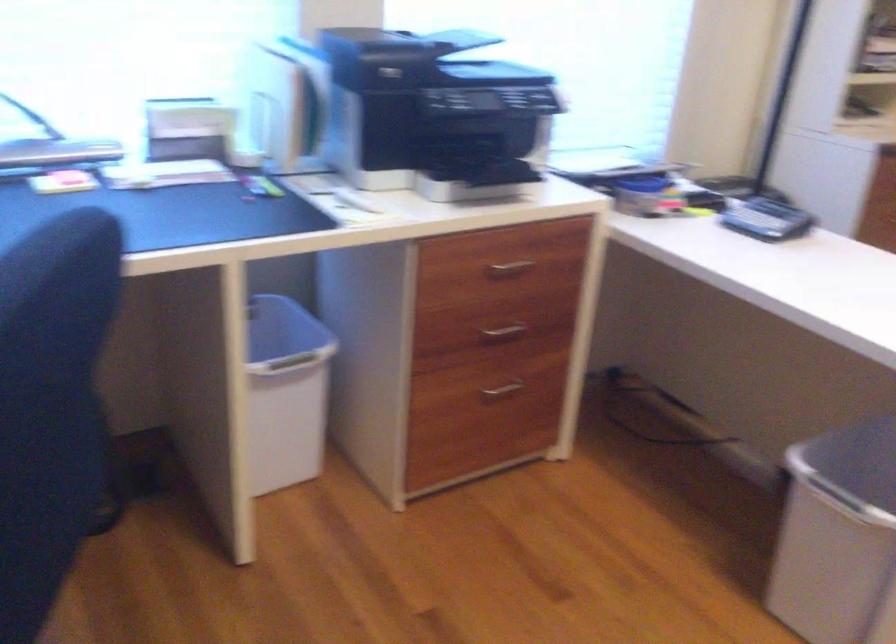
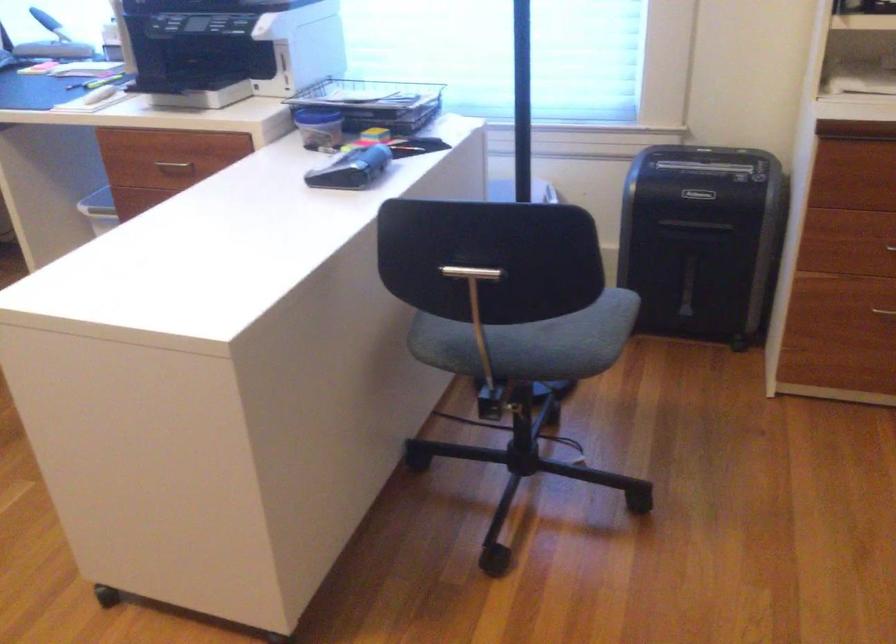
Question: I am providing you with two images of the same scene from different viewpoints. After the viewpoint changes to image2, which objects are now occluded?

Choices:
 (A) silver trash can lid
 (B) black tape dispenser
 (C) chair sitting surface
 (D) metal wastebasket

Answer: (A)